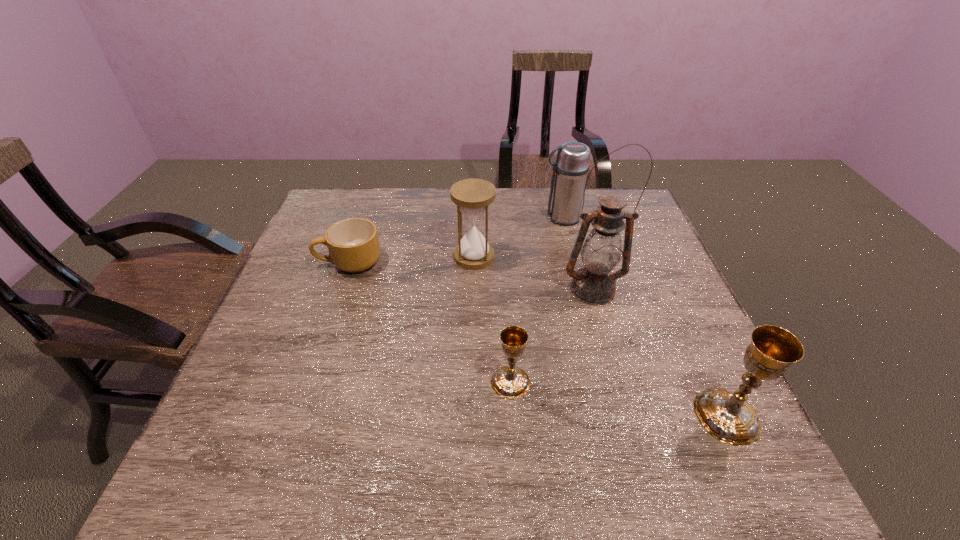
Where is `the left chalice`? the left chalice is located at coordinates (510, 382).

What are the coordinates of `the shorter chalice` in the screenshot? It's located at (510, 382).

You are a GUI agent. You are given a task and a screenshot of the screen. Output one action in this format:
    pyautogui.click(x=<x>, y=<y>)
    Task: Click on the rightmost object
    This screenshot has width=960, height=540.
    Given the screenshot: What is the action you would take?
    pyautogui.click(x=726, y=415)

The height and width of the screenshot is (540, 960). What are the coordinates of `the taller chalice` in the screenshot? It's located at (726, 415).

At what (x,y) coordinates should I click in order to perform the action: click on the farthest object. Please return your answer as a coordinate pair (x, y). Looking at the image, I should click on (571, 167).

The height and width of the screenshot is (540, 960). Identify the location of the shortest object. (353, 244).

Identify the location of mug. This screenshot has width=960, height=540. (353, 244).

This screenshot has height=540, width=960. Identify the location of hourglass. (473, 196).

Where is `oil lamp`? Image resolution: width=960 pixels, height=540 pixels. oil lamp is located at coordinates (594, 284).

Locate an element on the screen. This screenshot has height=540, width=960. vacant space situated on the right of the fifth tallest object is located at coordinates (678, 382).